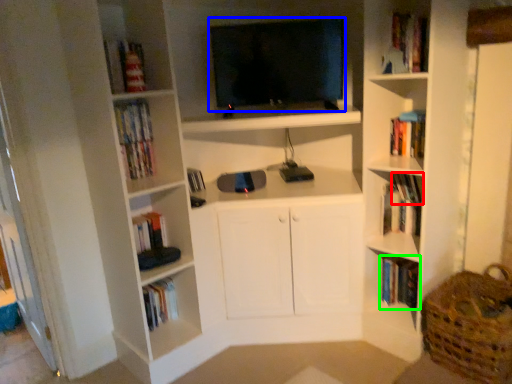
Question: Which is farther away from book (highlighted by a red box)? television (highlighted by a blue box) or book (highlighted by a green box)?

Choices:
 (A) television
 (B) book

Answer: (A)